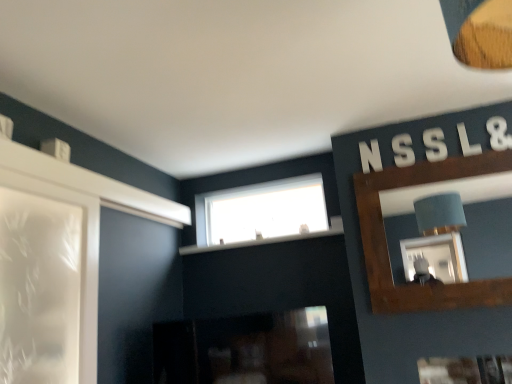
What do you see at coordinates (435, 144) in the screenshot? I see `white plastic letter s at upper right, which appears as the 3th letter when viewed from the left` at bounding box center [435, 144].

Locate an element on the screen. This screenshot has height=384, width=512. white plastic letter s at upper right, which is the 3th letter from right to left is located at coordinates (x=435, y=144).

Image resolution: width=512 pixels, height=384 pixels. What are the coordinates of `transparent glass window at upper center` in the screenshot? It's located at (262, 211).

Which is nearer, (477, 148) or (373, 162)?

Point (477, 148) is closer to the camera than point (373, 162).

Which object is further away from the camera taking this photo, white plastic letter at upper right, arranged as the second letter when viewed from the right, or white plastic letter n at upper right, which is the first letter in left-to-right order?

white plastic letter n at upper right, which is the first letter in left-to-right order, is further from the camera.

Measure the distance between white plastic letter at upper right, arranged as the second letter when viewed from the right, and white plastic letter n at upper right, acting as the fifth letter starting from the right.

→ A distance of 20.98 inches exists between white plastic letter at upper right, arranged as the second letter when viewed from the right, and white plastic letter n at upper right, acting as the fifth letter starting from the right.

Is white plastic letter at upper right, which is the fourth letter in left-to-right order, completely or partially outside of white plastic letter n at upper right, acting as the fifth letter starting from the right?

Yes, white plastic letter at upper right, which is the fourth letter in left-to-right order, is located beyond the bounds of white plastic letter n at upper right, acting as the fifth letter starting from the right.

Is transparent glass window at upper center taller than white plastic letter at upper right, which ranks as the fifth letter in left-to-right order?

Yes, transparent glass window at upper center is taller than white plastic letter at upper right, which ranks as the fifth letter in left-to-right order.

Is transparent glass window at upper center thinner than white plastic letter at upper right, placed as the 1th letter when sorted from right to left?

No.

What's the angular difference between transparent glass window at upper center and white plastic letter at upper right, which ranks as the fifth letter in left-to-right order,'s facing directions?

They differ by 0.172 degrees in their facing directions.

Does transparent glass window at upper center turn towards white plastic letter at upper right, placed as the 1th letter when sorted from right to left?

No.

Which object is closer to the camera taking this photo, white plastic letter s at upper right, which is the 3th letter from right to left, or transparent glass window at upper center?

white plastic letter s at upper right, which is the 3th letter from right to left.

From the image's perspective, between white plastic letter s at upper right, which is the 3th letter from right to left, and transparent glass window at upper center, which one is located above?

white plastic letter s at upper right, which is the 3th letter from right to left.

Is white plastic letter s at upper right, which is the 3th letter from right to left, next to transparent glass window at upper center?

No, white plastic letter s at upper right, which is the 3th letter from right to left, is not beside transparent glass window at upper center.

Is white plastic letter s at upper right, which is the 3th letter from right to left, bigger or smaller than transparent glass window at upper center?

Considering their sizes, white plastic letter s at upper right, which is the 3th letter from right to left, takes up less space than transparent glass window at upper center.

From the image's perspective, count 2nd letters upward from the transparent glass window at upper center and point to it. Please provide its 2D coordinates.

[(403, 150)]

Between white plastic letter s at upper right, which is counted as the 2th letter, starting from the left, and transparent glass window at upper center, which one has less height?

white plastic letter s at upper right, which is counted as the 2th letter, starting from the left.

Between white plastic letter s at upper right, acting as the 4th letter starting from the right, and transparent glass window at upper center, which one is positioned in front?

white plastic letter s at upper right, acting as the 4th letter starting from the right.

How many degrees apart are the facing directions of white plastic letter s at upper right, acting as the 4th letter starting from the right, and transparent glass window at upper center?

There is a 0.0248-degree angle between the facing directions of white plastic letter s at upper right, acting as the 4th letter starting from the right, and transparent glass window at upper center.

Who is smaller, white plastic letter at upper right, placed as the 1th letter when sorted from right to left, or transparent glass window at upper center?

white plastic letter at upper right, placed as the 1th letter when sorted from right to left.

Considering the sizes of objects white plastic letter at upper right, which ranks as the fifth letter in left-to-right order, and transparent glass window at upper center in the image provided, who is thinner, white plastic letter at upper right, which ranks as the fifth letter in left-to-right order, or transparent glass window at upper center?

Thinner between the two is white plastic letter at upper right, which ranks as the fifth letter in left-to-right order.

Is white plastic letter at upper right, placed as the 1th letter when sorted from right to left, oriented towards transparent glass window at upper center?

No, white plastic letter at upper right, placed as the 1th letter when sorted from right to left, is not aimed at transparent glass window at upper center.

Are white plastic letter at upper right, placed as the 1th letter when sorted from right to left, and transparent glass window at upper center located far from each other?

Indeed, white plastic letter at upper right, placed as the 1th letter when sorted from right to left, is not near transparent glass window at upper center.

Is white plastic letter at upper right, which is the fourth letter in left-to-right order, next to white plastic letter s at upper right, which appears as the 3th letter when viewed from the left?

There is a gap between white plastic letter at upper right, which is the fourth letter in left-to-right order, and white plastic letter s at upper right, which appears as the 3th letter when viewed from the left.

Consider the image. Which object is closer to the camera, white plastic letter at upper right, which is the fourth letter in left-to-right order, or white plastic letter s at upper right, which is the 3th letter from right to left?

white plastic letter at upper right, which is the fourth letter in left-to-right order.

Consider the image. In terms of size, does white plastic letter at upper right, arranged as the second letter when viewed from the right, appear bigger or smaller than white plastic letter s at upper right, which is the 3th letter from right to left?

white plastic letter at upper right, arranged as the second letter when viewed from the right, is bigger than white plastic letter s at upper right, which is the 3th letter from right to left.

Which is more to the left, white plastic letter n at upper right, acting as the fifth letter starting from the right, or white plastic letter s at upper right, acting as the 4th letter starting from the right?

Positioned to the left is white plastic letter n at upper right, acting as the fifth letter starting from the right.

Is point (366, 147) in front of point (409, 152)?

No, (366, 147) is behind (409, 152).

Based on their sizes in the image, would you say white plastic letter n at upper right, acting as the fifth letter starting from the right, is bigger or smaller than white plastic letter s at upper right, which is counted as the 2th letter, starting from the left?

In the image, white plastic letter n at upper right, acting as the fifth letter starting from the right, appears to be larger than white plastic letter s at upper right, which is counted as the 2th letter, starting from the left.

Where is `the 3rd letter above the white plastic letter n at upper right, acting as the fifth letter starting from the right (from the image's perspective)`? The image size is (512, 384). the 3rd letter above the white plastic letter n at upper right, acting as the fifth letter starting from the right (from the image's perspective) is located at coordinates (467, 142).

Find the location of a particular element. window on the left of white plastic letter at upper right, placed as the 1th letter when sorted from right to left is located at coordinates (262, 211).

When comparing their distances from white plastic letter at upper right, arranged as the second letter when viewed from the right, does white plastic letter s at upper right, acting as the 4th letter starting from the right, or white plastic letter at upper right, placed as the 1th letter when sorted from right to left, seem further?

white plastic letter s at upper right, acting as the 4th letter starting from the right, lies further to white plastic letter at upper right, arranged as the second letter when viewed from the right, than the other object.

When comparing their distances from white plastic letter n at upper right, which is the first letter in left-to-right order, does white plastic letter at upper right, arranged as the second letter when viewed from the right, or white plastic letter at upper right, placed as the 1th letter when sorted from right to left, seem further?

Based on the image, white plastic letter at upper right, placed as the 1th letter when sorted from right to left, appears to be further to white plastic letter n at upper right, which is the first letter in left-to-right order.

From the picture: Estimate the real-world distances between objects in this image. Which object is closer to brown wooden mirror at upper right, white plastic letter at upper right, placed as the 1th letter when sorted from right to left, or white plastic letter s at upper right, which is counted as the 2th letter, starting from the left?

white plastic letter at upper right, placed as the 1th letter when sorted from right to left, is positioned closer to the anchor brown wooden mirror at upper right.

When comparing their distances from white plastic letter at upper right, which ranks as the fifth letter in left-to-right order, does white plastic letter at upper right, arranged as the second letter when viewed from the right, or white plastic letter s at upper right, which is counted as the 2th letter, starting from the left, seem closer?

Among the two, white plastic letter at upper right, arranged as the second letter when viewed from the right, is located nearer to white plastic letter at upper right, which ranks as the fifth letter in left-to-right order.

Estimate the real-world distances between objects in this image. Which object is closer to white plastic letter n at upper right, acting as the fifth letter starting from the right, white plastic letter s at upper right, which appears as the 3th letter when viewed from the left, or brown wooden mirror at upper right?

white plastic letter s at upper right, which appears as the 3th letter when viewed from the left, lies closer to white plastic letter n at upper right, acting as the fifth letter starting from the right, than the other object.

Based on their spatial positions, is white plastic letter s at upper right, which is counted as the 2th letter, starting from the left, or white plastic letter at upper right, placed as the 1th letter when sorted from right to left, closer to transparent glass window at upper center?

Among the two, white plastic letter s at upper right, which is counted as the 2th letter, starting from the left, is located nearer to transparent glass window at upper center.

Based on their spatial positions, is white plastic letter n at upper right, acting as the fifth letter starting from the right, or white plastic letter s at upper right, acting as the 4th letter starting from the right, closer to white plastic letter at upper right, placed as the 1th letter when sorted from right to left?

Among the two, white plastic letter s at upper right, acting as the 4th letter starting from the right, is located nearer to white plastic letter at upper right, placed as the 1th letter when sorted from right to left.

When comparing their distances from white plastic letter at upper right, arranged as the second letter when viewed from the right, does white plastic letter s at upper right, which is counted as the 2th letter, starting from the left, or white plastic letter n at upper right, which is the first letter in left-to-right order, seem closer?

white plastic letter s at upper right, which is counted as the 2th letter, starting from the left, is positioned closer to the anchor white plastic letter at upper right, arranged as the second letter when viewed from the right.

You are a GUI agent. You are given a task and a screenshot of the screen. Output one action in this format:
    pyautogui.click(x=<x>, y=<y>)
    Task: Click on the mirror between transparent glass window at upper center and white plastic letter s at upper right, which is the 3th letter from right to left
    
    Given the screenshot: What is the action you would take?
    (462, 228)

Locate an element on the screen. mirror located between white plastic letter n at upper right, acting as the fifth letter starting from the right, and white plastic letter at upper right, which ranks as the fifth letter in left-to-right order, in the left-right direction is located at coordinates (462, 228).

Image resolution: width=512 pixels, height=384 pixels. In order to click on letter between transparent glass window at upper center and white plastic letter s at upper right, which is counted as the 2th letter, starting from the left, from left to right in this screenshot , I will do `click(370, 156)`.

Image resolution: width=512 pixels, height=384 pixels. Identify the location of letter between white plastic letter s at upper right, which is counted as the 2th letter, starting from the left, and brown wooden mirror at upper right vertically. tap(370, 156).